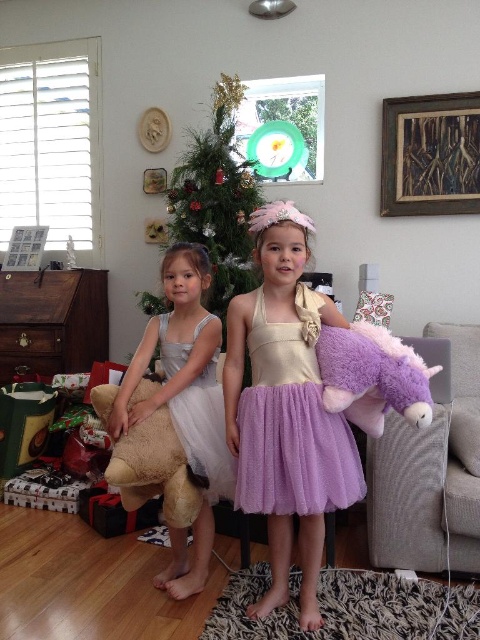
Question: Which object is farther from the camera taking this photo?

Choices:
 (A) white tulle dress at center
 (B) silvery tulle dress at left
 (C) lavender tulle dress at center
 (D) purple plush unicorn at right

Answer: (A)

Question: Which object is farther from the camera taking this photo?

Choices:
 (A) white tulle dress at center
 (B) lavender tulle skirt at center
 (C) purple plush unicorn at right
 (D) soft brown teddy bear at lower left

Answer: (A)

Question: Estimate the real-world distances between objects in this image. Which object is closer to the lavender tulle dress at center?

Choices:
 (A) soft brown teddy bear at lower left
 (B) purple plush unicorn at right
 (C) white tulle dress at center

Answer: (B)

Question: Is green textured christmas tree at center closer to camera compared to soft brown teddy bear at lower left?

Choices:
 (A) yes
 (B) no

Answer: (B)

Question: Is lavender tulle dress at center closer to camera compared to white tulle dress at center?

Choices:
 (A) yes
 (B) no

Answer: (A)

Question: Is silvery tulle dress at left to the left of purple plush unicorn at right from the viewer's perspective?

Choices:
 (A) yes
 (B) no

Answer: (A)